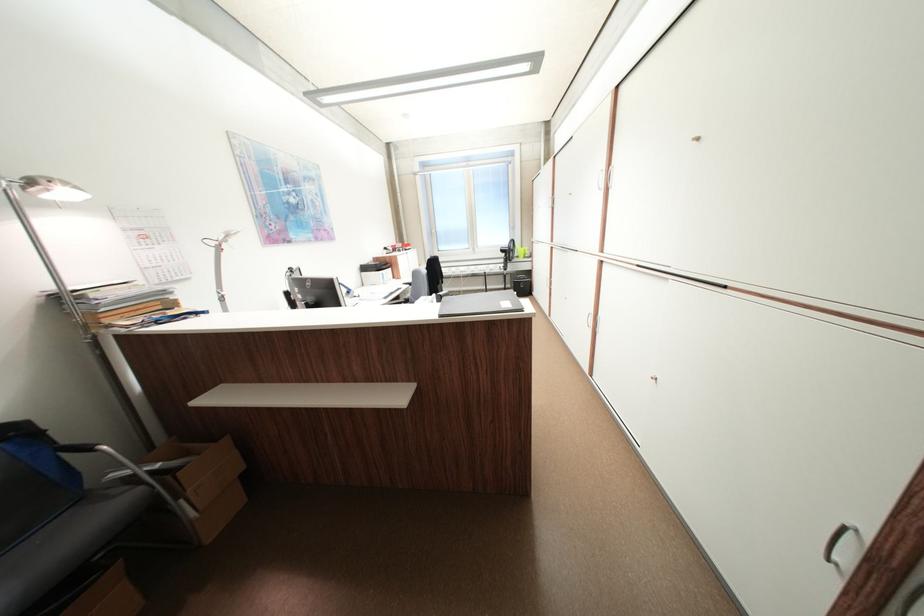
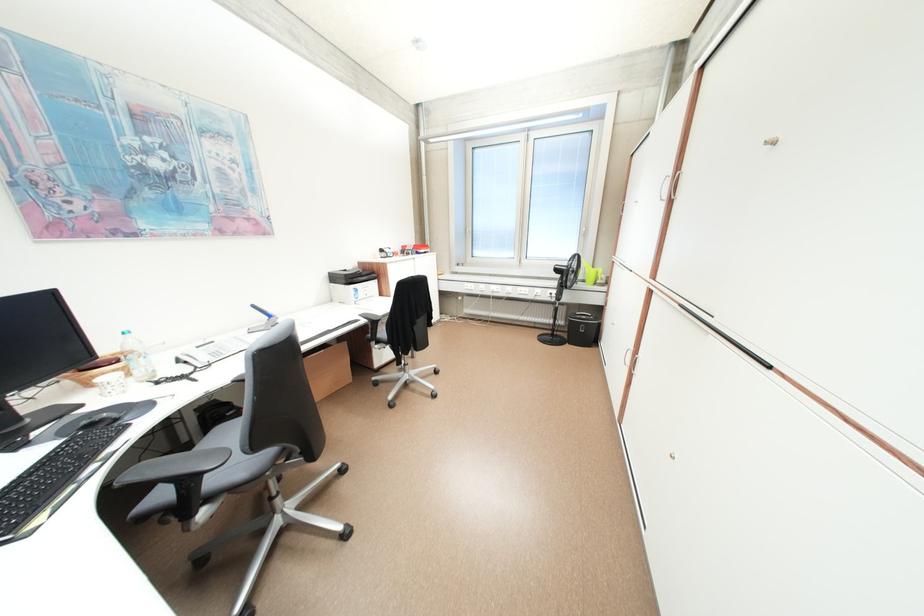
Where in the second image is the point corresponding to point 529,251 from the first image?

(598, 273)